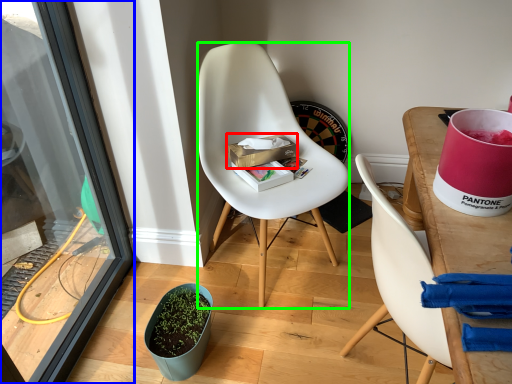
Question: Based on their relative distances, which object is farther from box (highlighted by a red box)? Choose from screen door (highlighted by a blue box) and chair (highlighted by a green box).

Choices:
 (A) screen door
 (B) chair

Answer: (A)